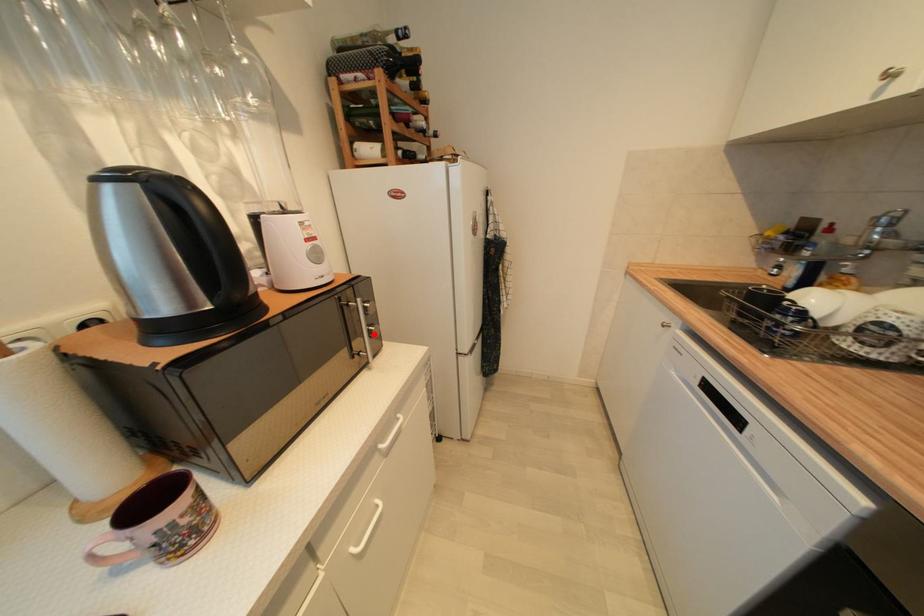
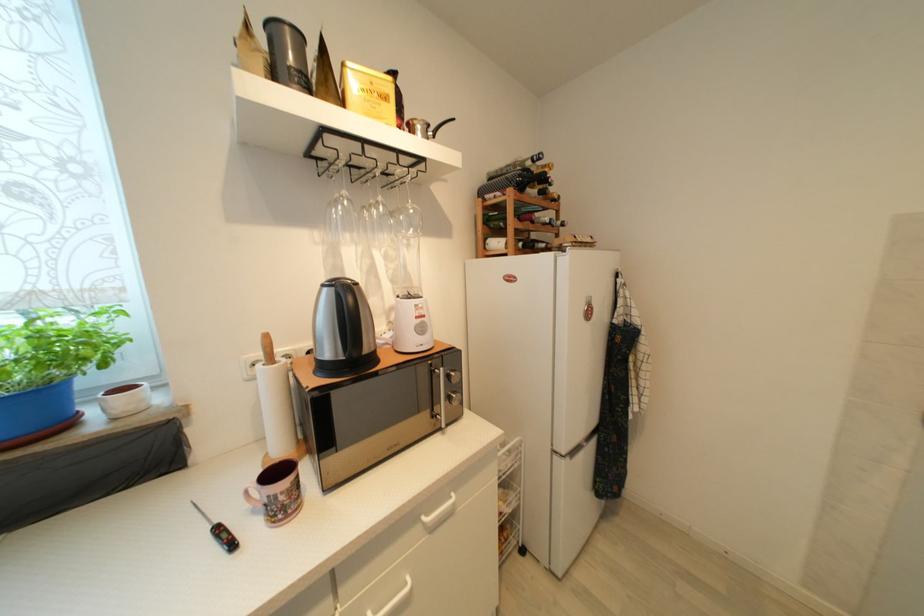
Question: I am providing you with two images of the same scene from different viewpoints. A red point is marked on the first image. Can you still see the location of the red point in image 2?

Choices:
 (A) Yes
 (B) No

Answer: (A)